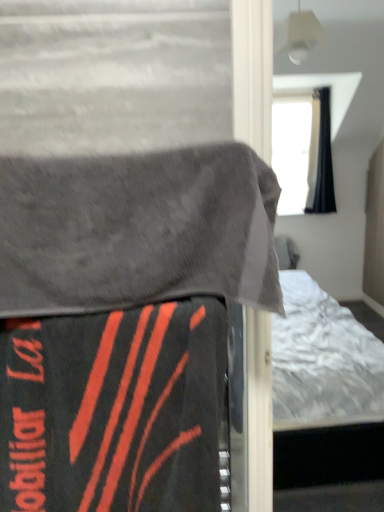
Question: Is black matte blanket at lower left, the 1th blanket from the bottom, inside gray fabric blanket at upper left, placed as the 2th blanket when sorted from bottom to top?

Choices:
 (A) yes
 (B) no

Answer: (B)

Question: Is gray fabric blanket at upper left, placed as the 2th blanket when sorted from bottom to top, in front of black matte blanket at lower left, positioned as the second blanket in top-to-bottom order?

Choices:
 (A) yes
 (B) no

Answer: (A)

Question: Considering the relative sizes of gray fabric blanket at upper left, the first blanket in the top-to-bottom sequence, and black matte blanket at lower left, positioned as the second blanket in top-to-bottom order, in the image provided, is gray fabric blanket at upper left, the first blanket in the top-to-bottom sequence, thinner than black matte blanket at lower left, positioned as the second blanket in top-to-bottom order,?

Choices:
 (A) no
 (B) yes

Answer: (A)

Question: Is gray fabric blanket at upper left, the first blanket in the top-to-bottom sequence, oriented away from black matte blanket at lower left, positioned as the second blanket in top-to-bottom order?

Choices:
 (A) yes
 (B) no

Answer: (B)

Question: Is the depth of gray fabric blanket at upper left, the first blanket in the top-to-bottom sequence, greater than that of black matte blanket at lower left, positioned as the second blanket in top-to-bottom order?

Choices:
 (A) yes
 (B) no

Answer: (B)

Question: Can you confirm if gray fabric blanket at upper left, the first blanket in the top-to-bottom sequence, is bigger than black matte blanket at lower left, positioned as the second blanket in top-to-bottom order?

Choices:
 (A) yes
 (B) no

Answer: (A)

Question: Could black matte blanket at lower left, the 1th blanket from the bottom, be considered to be inside velvet-like black bed at center?

Choices:
 (A) yes
 (B) no

Answer: (B)

Question: Is velvet-like black bed at center beside black matte blanket at lower left, positioned as the second blanket in top-to-bottom order?

Choices:
 (A) yes
 (B) no

Answer: (A)

Question: From the image's perspective, would you say velvet-like black bed at center is shown under black matte blanket at lower left, positioned as the second blanket in top-to-bottom order?

Choices:
 (A) yes
 (B) no

Answer: (B)

Question: Is velvet-like black bed at center positioned with its back to black matte blanket at lower left, positioned as the second blanket in top-to-bottom order?

Choices:
 (A) yes
 (B) no

Answer: (A)

Question: Does velvet-like black bed at center have a lesser width compared to black matte blanket at lower left, positioned as the second blanket in top-to-bottom order?

Choices:
 (A) no
 (B) yes

Answer: (B)

Question: From a real-world perspective, is velvet-like black bed at center located higher than black matte blanket at lower left, positioned as the second blanket in top-to-bottom order?

Choices:
 (A) yes
 (B) no

Answer: (A)

Question: Is gray fabric blanket at upper left, placed as the 2th blanket when sorted from bottom to top, inside black matte blanket at lower left, the 1th blanket from the bottom?

Choices:
 (A) no
 (B) yes

Answer: (A)